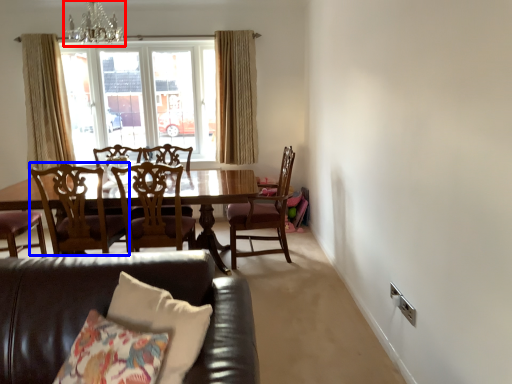
Question: Which object appears farthest to the camera in this image, chandelier (highlighted by a red box) or chair (highlighted by a blue box)?

Choices:
 (A) chandelier
 (B) chair

Answer: (A)